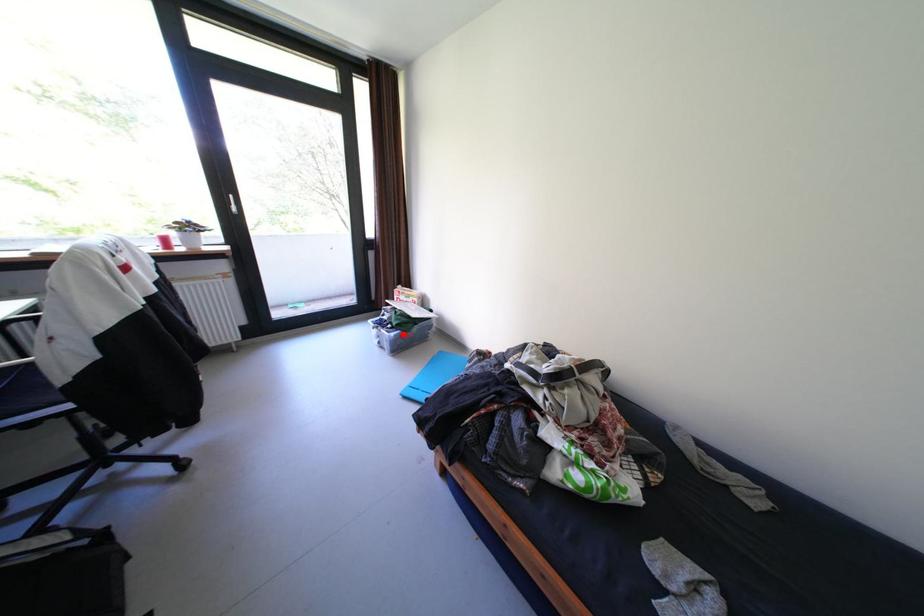
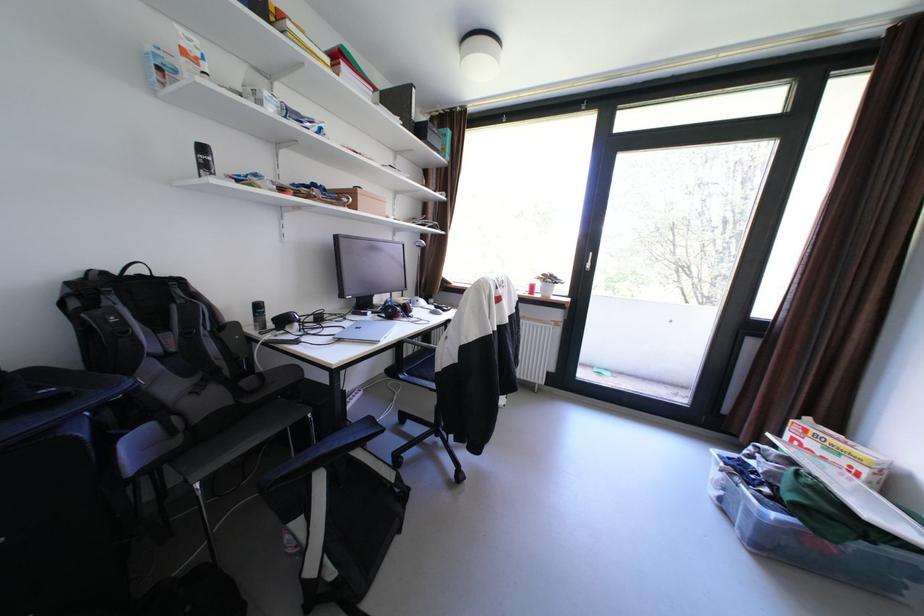
In the second image, find the point that corresponds to the highlighted location in the first image.

(784, 516)